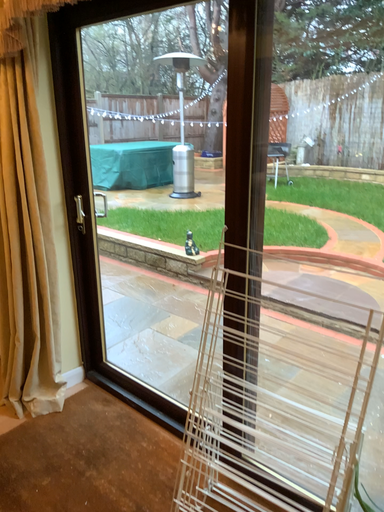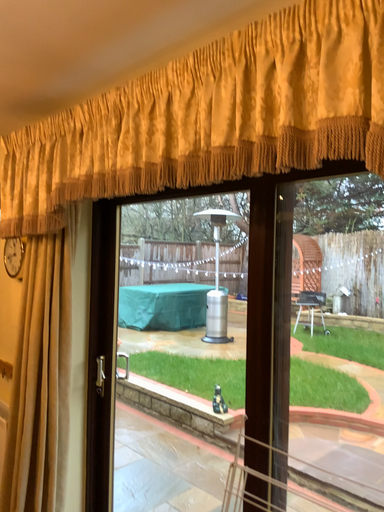
Question: How did the camera likely rotate when shooting the video?

Choices:
 (A) rotated upward
 (B) rotated downward

Answer: (A)